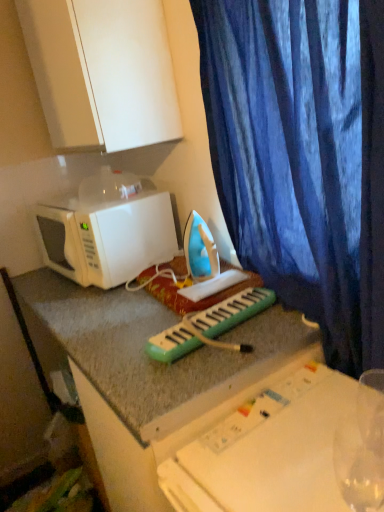
The width and height of the screenshot is (384, 512). Find the location of `blue velvet curtain at right`. blue velvet curtain at right is located at coordinates (303, 156).

You are a GUI agent. You are given a task and a screenshot of the screen. Output one action in this format:
    pyautogui.click(x=<x>, y=<y>)
    Task: Click on the white glossy cabinet at upper left
    This screenshot has width=384, height=512.
    Given the screenshot: What is the action you would take?
    pyautogui.click(x=102, y=71)

What do you see at coordinates (109, 238) in the screenshot? I see `white matte microwave at left` at bounding box center [109, 238].

Measure the distance between white matte microwave at left and camera.

white matte microwave at left and camera are 4.60 feet apart.

Where is `white plastic table at center`? The width and height of the screenshot is (384, 512). white plastic table at center is located at coordinates (288, 450).

How far apart are white glossy cabinet at upper left and blue velvet curtain at right?

19.21 inches.

Would you say white glossy cabinet at upper left contains blue velvet curtain at right?

No, blue velvet curtain at right is not inside white glossy cabinet at upper left.

Is white glossy cabinet at upper left oriented away from blue velvet curtain at right?

No, blue velvet curtain at right is not at the back of white glossy cabinet at upper left.

In the scene shown: Can you see white glossy cabinet at upper left touching blue velvet curtain at right?

white glossy cabinet at upper left and blue velvet curtain at right are not in contact.

Is white glossy cabinet at upper left located within green plastic musical keyboard at center?

No.

Looking at their sizes, would you say green plastic musical keyboard at center is wider or thinner than white glossy cabinet at upper left?

→ green plastic musical keyboard at center is wider than white glossy cabinet at upper left.

What's the angular difference between green plastic musical keyboard at center and white glossy cabinet at upper left's facing directions?

green plastic musical keyboard at center and white glossy cabinet at upper left are facing 3.9 degrees away from each other.

From a real-world perspective, who is located lower, green plastic musical keyboard at center or white glossy cabinet at upper left?

From a 3D spatial view, green plastic musical keyboard at center is below.

Looking at the image, does white matte microwave at left seem bigger or smaller compared to white glossy cabinet at upper left?

Considering their sizes, white matte microwave at left takes up less space than white glossy cabinet at upper left.

Is the surface of white matte microwave at left in direct contact with white glossy cabinet at upper left?

No, white matte microwave at left is not touching white glossy cabinet at upper left.

Between white matte microwave at left and white glossy cabinet at upper left, which one appears on the left side from the viewer's perspective?

white matte microwave at left.

Does green plastic musical keyboard at center contain blue velvet curtain at right?

That's incorrect, blue velvet curtain at right is not inside green plastic musical keyboard at center.

Can you confirm if green plastic musical keyboard at center is shorter than blue velvet curtain at right?

Correct, green plastic musical keyboard at center is not as tall as blue velvet curtain at right.

Is green plastic musical keyboard at center next to blue velvet curtain at right?

There is a gap between green plastic musical keyboard at center and blue velvet curtain at right.

Can you confirm if green plastic musical keyboard at center is positioned to the right of blue velvet curtain at right?

No.

From their relative heights in the image, would you say white plastic table at center is taller or shorter than white matte microwave at left?

white plastic table at center is taller than white matte microwave at left.

Does white plastic table at center touch white matte microwave at left?

No.

Can you confirm if white plastic table at center is positioned to the left of white matte microwave at left?

In fact, white plastic table at center is to the right of white matte microwave at left.

How much distance is there between white matte microwave at left and blue velvet curtain at right?

white matte microwave at left is 23.46 inches away from blue velvet curtain at right.

From the picture: Is white matte microwave at left surrounding blue velvet curtain at right?

That's incorrect, blue velvet curtain at right is not inside white matte microwave at left.

Considering the relative sizes of white matte microwave at left and blue velvet curtain at right in the image provided, is white matte microwave at left thinner than blue velvet curtain at right?

No.

Which is behind, white matte microwave at left or blue velvet curtain at right?

Positioned behind is white matte microwave at left.

Image resolution: width=384 pixels, height=512 pixels. I want to click on table that appears on the right of green plastic musical keyboard at center, so click(x=288, y=450).

What's the angular difference between white plastic table at center and green plastic musical keyboard at center's facing directions?

4.11 degrees.

Is point (176, 487) behind point (210, 318)?

No, it is in front of (210, 318).

Is white plastic table at center surrounding green plastic musical keyboard at center?

No.

Where is `cabinetry on the left of blue velvet curtain at right`? This screenshot has height=512, width=384. cabinetry on the left of blue velvet curtain at right is located at coordinates (102, 71).

Where is `musical keyboard that is in front of the white glossy cabinet at upper left`? musical keyboard that is in front of the white glossy cabinet at upper left is located at coordinates (231, 312).

Based on their spatial positions, is green plastic musical keyboard at center or white matte microwave at left further from white glossy cabinet at upper left?

Among the two, green plastic musical keyboard at center is located further to white glossy cabinet at upper left.

Looking at the image, which one is located closer to green plastic musical keyboard at center, blue velvet curtain at right or white matte microwave at left?

blue velvet curtain at right lies closer to green plastic musical keyboard at center than the other object.

Which object lies nearer to the anchor point white plastic table at center, white glossy cabinet at upper left or blue velvet curtain at right?

blue velvet curtain at right is positioned closer to the anchor white plastic table at center.

Which object lies further to the anchor point white plastic table at center, blue velvet curtain at right or green plastic musical keyboard at center?

blue velvet curtain at right is positioned further to the anchor white plastic table at center.

Based on their spatial positions, is white plastic table at center or green plastic musical keyboard at center further from white matte microwave at left?

The object further to white matte microwave at left is white plastic table at center.

Based on their spatial positions, is white matte microwave at left or green plastic musical keyboard at center closer to white glossy cabinet at upper left?

white matte microwave at left lies closer to white glossy cabinet at upper left than the other object.

Considering their positions, is green plastic musical keyboard at center positioned further to white plastic table at center than white matte microwave at left?

white matte microwave at left is further to white plastic table at center.

Which object lies further to the anchor point blue velvet curtain at right, white plastic table at center or green plastic musical keyboard at center?

white plastic table at center.

This screenshot has height=512, width=384. What are the coordinates of `curtain that lies between white glossy cabinet at upper left and green plastic musical keyboard at center from top to bottom` in the screenshot? It's located at (303, 156).

Where is `musical keyboard between white plastic table at center and white matte microwave at left along the z-axis`? This screenshot has height=512, width=384. musical keyboard between white plastic table at center and white matte microwave at left along the z-axis is located at coordinates 231,312.

This screenshot has height=512, width=384. What are the coordinates of `musical keyboard between blue velvet curtain at right and white plastic table at center from top to bottom` in the screenshot? It's located at (231, 312).

This screenshot has width=384, height=512. Find the location of `microwave oven between white glossy cabinet at upper left and white plastic table at center in the up-down direction`. microwave oven between white glossy cabinet at upper left and white plastic table at center in the up-down direction is located at coordinates (109, 238).